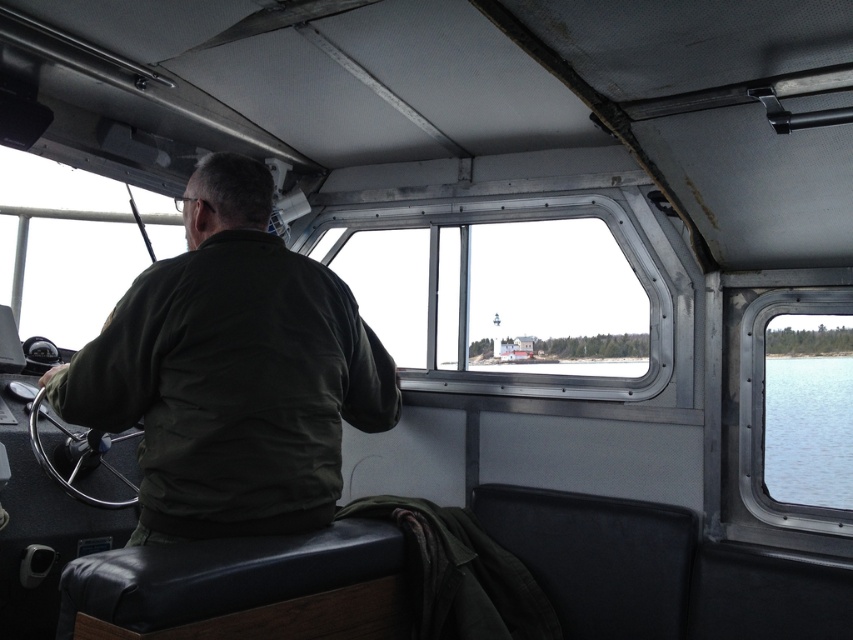
From the picture: You are the boat captain trying to navigate using the clear glass window at center and the transparent water at lower right. Which object would allow you to see the lighthouse on the horizon?

The clear glass window at center is above the transparent water at lower right, so the clear glass window at center would allow you to see the lighthouse on the horizon.

You are a passenger on the boat and want to look outside through the clear glass window at center and the transparent water at lower right. Which one allows you to see the lighthouse on the horizon better?

The clear glass window at center allows you to see the lighthouse on the horizon better because it is taller than the transparent water at lower right.

You are navigating a boat and want to check the water level near the transparent water at lower right. Where exactly should you look on the cabin window?

You should look at point (808, 429) on the cabin window to check the transparent water at lower right.